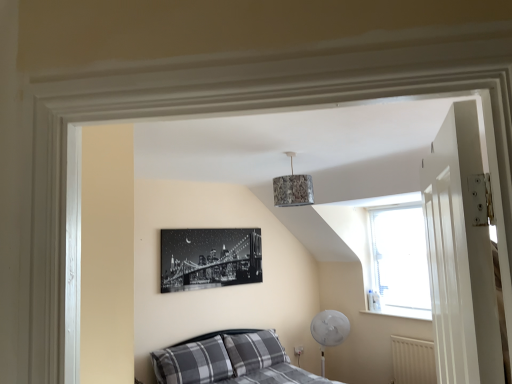
Question: From the image's perspective, is plaid fabric pillow at lower left, which is counted as the first pillow, starting from the left, positioned above or below white textured radiator at lower right?

Choices:
 (A) below
 (B) above

Answer: (B)

Question: From a real-world perspective, relative to white textured radiator at lower right, is plaid fabric pillow at lower left, positioned as the 2th pillow in right-to-left order, vertically above or below?

Choices:
 (A) above
 (B) below

Answer: (A)

Question: Which object is the closest to the gray plaid pillow at lower center, the first pillow viewed from the right?

Choices:
 (A) textured fabric lampshade at upper center
 (B) white textured radiator at lower right
 (C) plaid fabric bed at lower left
 (D) plaid fabric pillow at lower left, positioned as the 2th pillow in right-to-left order
 (E) white glossy door at right

Answer: (C)

Question: Which object is the closest to the plaid fabric pillow at lower left, which is counted as the first pillow, starting from the left?

Choices:
 (A) white glossy door at right
 (B) white textured radiator at lower right
 (C) black and white canvas print at center
 (D) textured fabric lampshade at upper center
 (E) transparent glass window at upper right

Answer: (C)